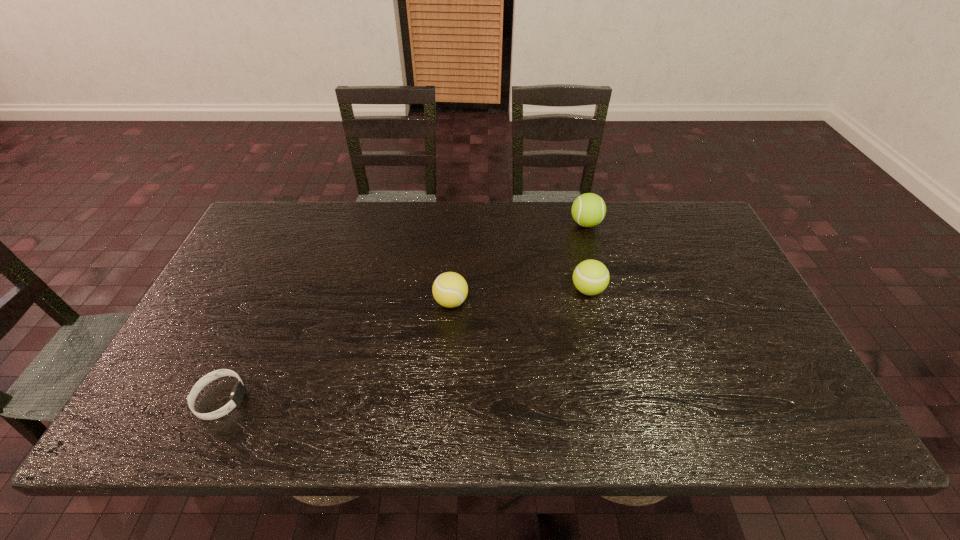
The image size is (960, 540). I want to click on object present at the near left corner, so click(236, 397).

Where is `vacant space at the far edge of the desktop`? vacant space at the far edge of the desktop is located at coordinates (623, 207).

Locate an element on the screen. This screenshot has height=540, width=960. free spot at the near edge of the desktop is located at coordinates (350, 431).

Identify the location of free space at the left edge. (230, 281).

You are a GUI agent. You are given a task and a screenshot of the screen. Output one action in this format:
    pyautogui.click(x=<x>, y=<y>)
    Task: Click on the free spot at the right edge of the desktop
    This screenshot has width=960, height=540.
    Given the screenshot: What is the action you would take?
    pyautogui.click(x=739, y=396)

At what (x,y) coordinates should I click in order to perform the action: click on vacant space at the near left corner of the desktop. Please return your answer as a coordinate pair (x, y). Looking at the image, I should click on (178, 431).

This screenshot has width=960, height=540. I want to click on vacant region at the far right corner, so click(x=657, y=219).

I want to click on free spot at the near right corner of the desktop, so click(x=788, y=423).

Locate an element on the screen. This screenshot has height=540, width=960. free space that is in between the leftmost tennis ball and the leftmost object is located at coordinates (336, 350).

This screenshot has height=540, width=960. In order to click on free space that is in between the wristband and the farthest tennis ball in this screenshot , I will do `click(403, 311)`.